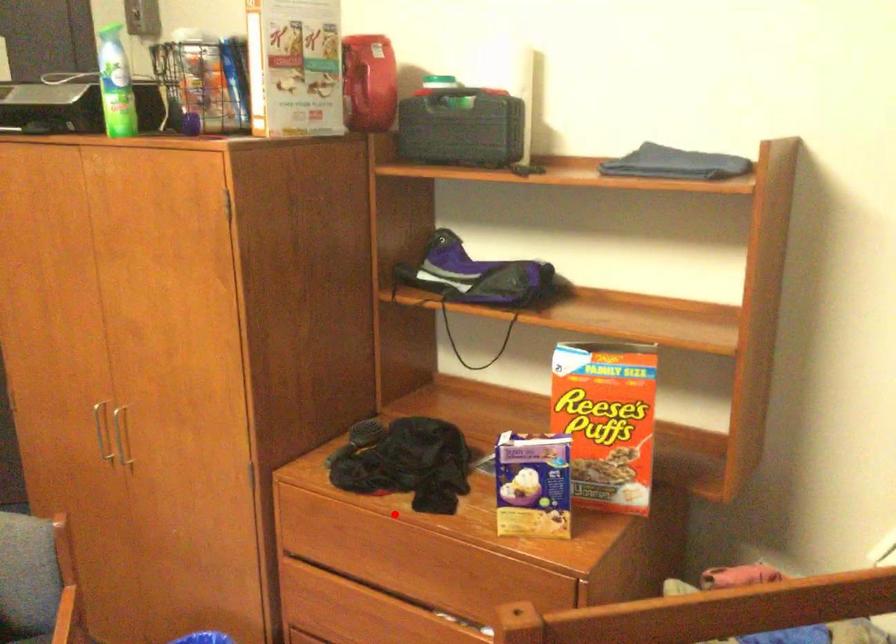
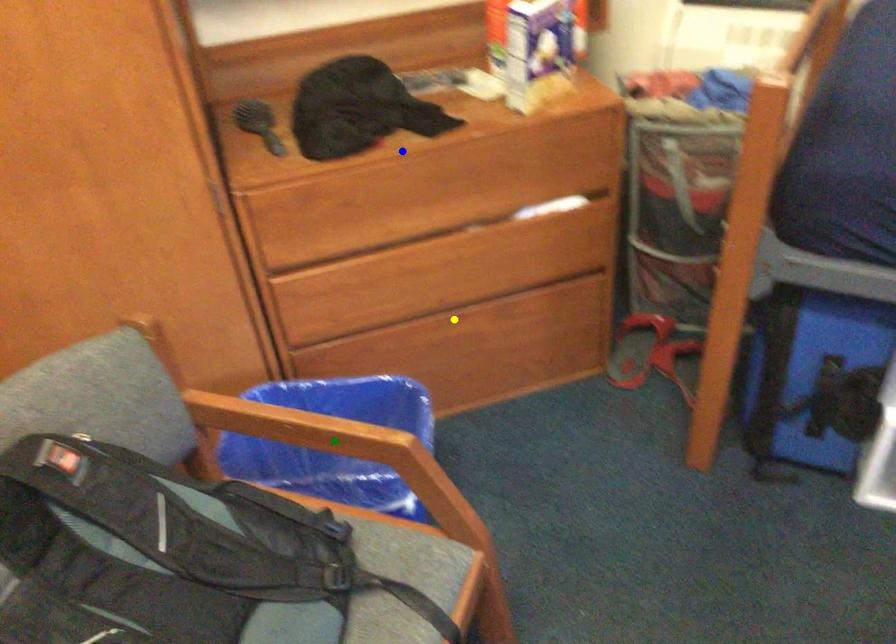
Question: I am providing you with two images of the same scene from different viewpoints. A red point is marked on the first image. You are given multiple points on the second image. Which mark in image 2 goes with the point in image 1?

Choices:
 (A) blue point
 (B) yellow point
 (C) green point

Answer: (A)